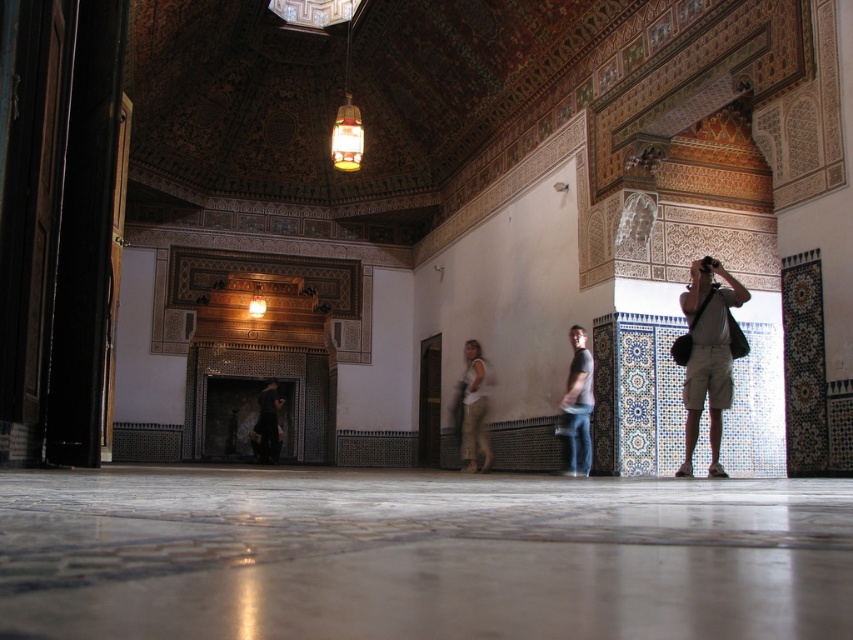
Is light beige shorts at right further to the viewer compared to dark brown leather jacket at center?

No, it is not.

Is point (685, 408) farther from viewer compared to point (263, 410)?

No.

Is point (718, 422) more distant than point (260, 420)?

No, (718, 422) is in front of (260, 420).

Image resolution: width=853 pixels, height=640 pixels. In order to click on light beige shorts at right in this screenshot , I will do `click(706, 356)`.

Can you confirm if light beige shorts at right is wider than denim jeans at center?

Correct, the width of light beige shorts at right exceeds that of denim jeans at center.

This screenshot has height=640, width=853. What do you see at coordinates (706, 356) in the screenshot? I see `light beige shorts at right` at bounding box center [706, 356].

Where is `light beige shorts at right`? This screenshot has width=853, height=640. light beige shorts at right is located at coordinates (706, 356).

Looking at this image, between light beige shorts at right and light beige cotton pants at center, which one appears on the left side from the viewer's perspective?

From the viewer's perspective, light beige cotton pants at center appears more on the left side.

I want to click on light beige shorts at right, so click(x=706, y=356).